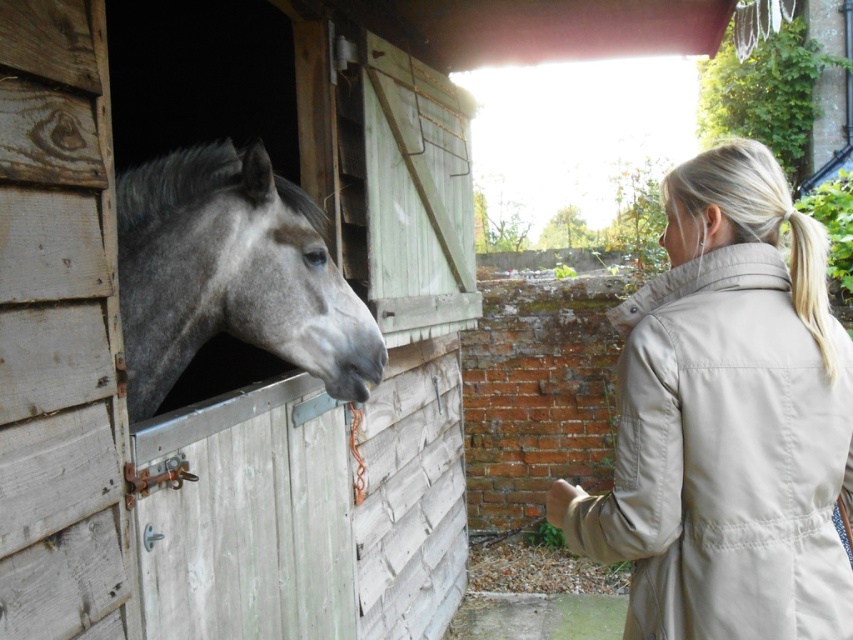
Is beige fabric trench coat at right shorter than matte skin nose at upper center?

No, beige fabric trench coat at right is not shorter than matte skin nose at upper center.

Does point (788, 397) come in front of point (664, 243)?

That is True.

The image size is (853, 640). I want to click on beige fabric trench coat at right, so click(724, 458).

Between point (726, 202) and point (660, 237), which one is positioned behind?

Point (660, 237)

Identify the location of blonde hair at upper right. (744, 198).

At what (x,y) coordinates should I click in order to perform the action: click on blonde hair at upper right. Please return your answer as a coordinate pair (x, y). This screenshot has width=853, height=640. Looking at the image, I should click on (744, 198).

Does gray matte horse at left appear on the left side of matte skin nose at upper center?

Correct, you'll find gray matte horse at left to the left of matte skin nose at upper center.

Identify the location of gray matte horse at left. (231, 275).